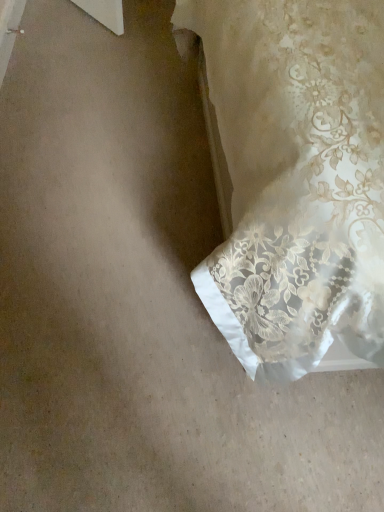
Measure the distance between point (290, 159) and camera.

The depth of point (290, 159) is 29.21 inches.

Find the location of a particular element. The height and width of the screenshot is (512, 384). white lace curtain at lower right is located at coordinates (296, 178).

What do you see at coordinates (296, 178) in the screenshot? I see `white lace curtain at lower right` at bounding box center [296, 178].

Where is `white lace curtain at lower right`? The width and height of the screenshot is (384, 512). white lace curtain at lower right is located at coordinates pos(296,178).